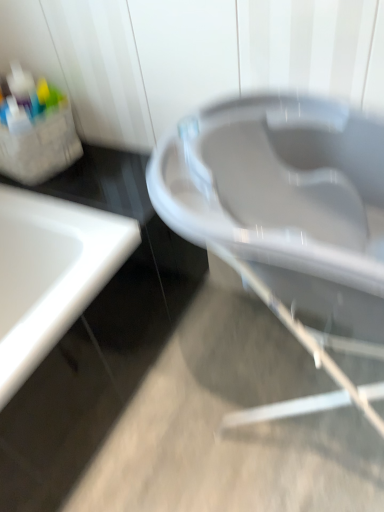
Question: Choose the correct answer: Is white plastic bath at center inside white glossy sink at left or outside it?

Choices:
 (A) inside
 (B) outside

Answer: (B)

Question: From the image's perspective, relative to white glossy sink at left, is white plastic bath at center above or below?

Choices:
 (A) below
 (B) above

Answer: (B)

Question: Looking at the image, does white plastic bath at center seem bigger or smaller compared to white glossy sink at left?

Choices:
 (A) small
 (B) big

Answer: (A)

Question: Is point (56, 329) closer or farther from the camera than point (322, 140)?

Choices:
 (A) farther
 (B) closer

Answer: (B)

Question: From the image's perspective, is white glossy sink at left above or below white plastic bath at center?

Choices:
 (A) above
 (B) below

Answer: (B)

Question: In the image, is white glossy sink at left positioned in front of or behind white plastic bath at center?

Choices:
 (A) behind
 (B) front

Answer: (A)

Question: In terms of width, does white glossy sink at left look wider or thinner when compared to white plastic bath at center?

Choices:
 (A) wide
 (B) thin

Answer: (A)